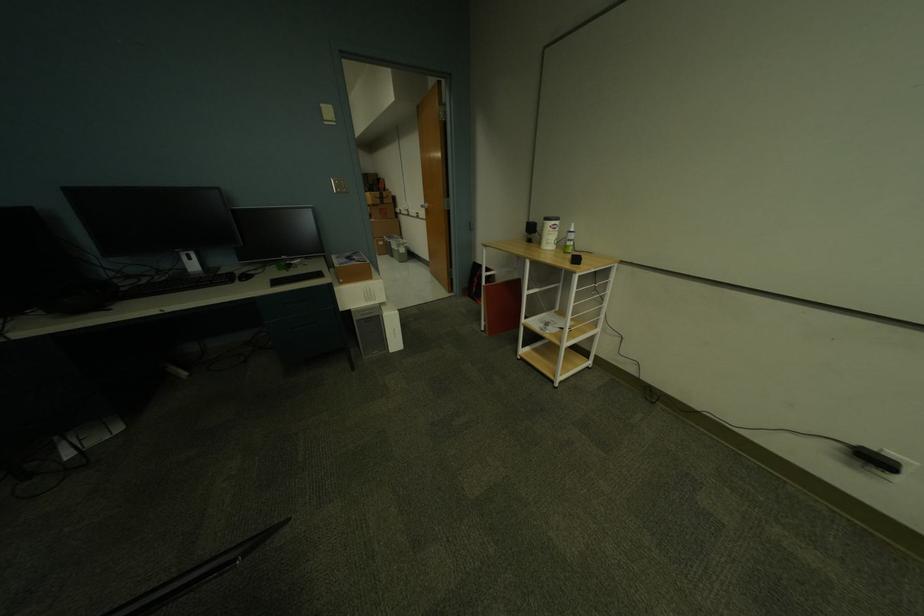
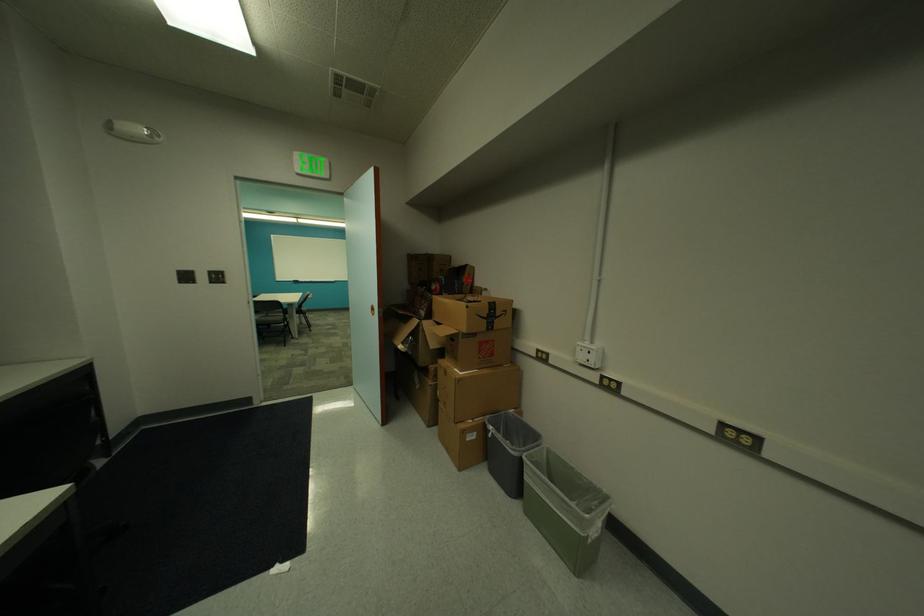
Which direction would the cameraman need to move to produce the second image?

The cameraman moved toward left, forward.